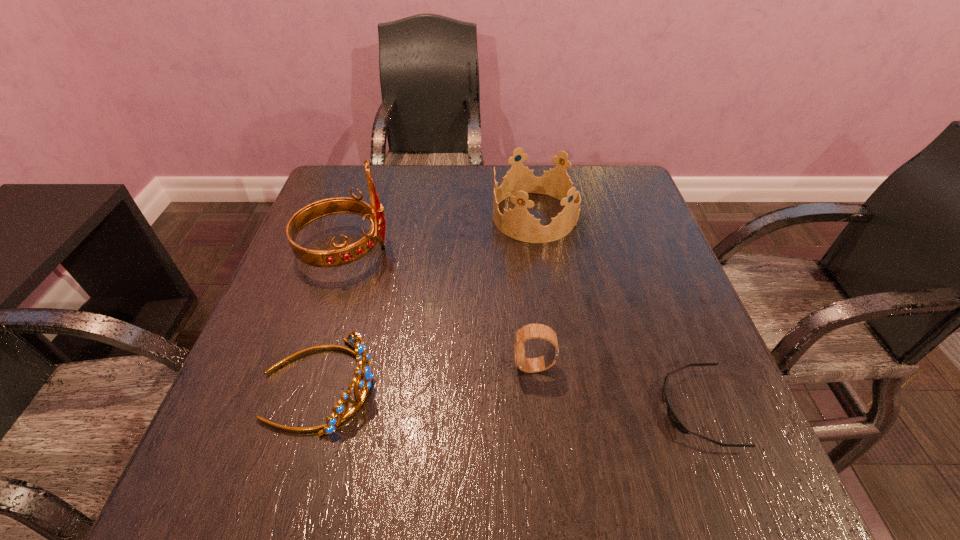
This screenshot has width=960, height=540. In order to click on tiara that is the second closest one to the second tallest tiara in this screenshot , I will do `click(354, 339)`.